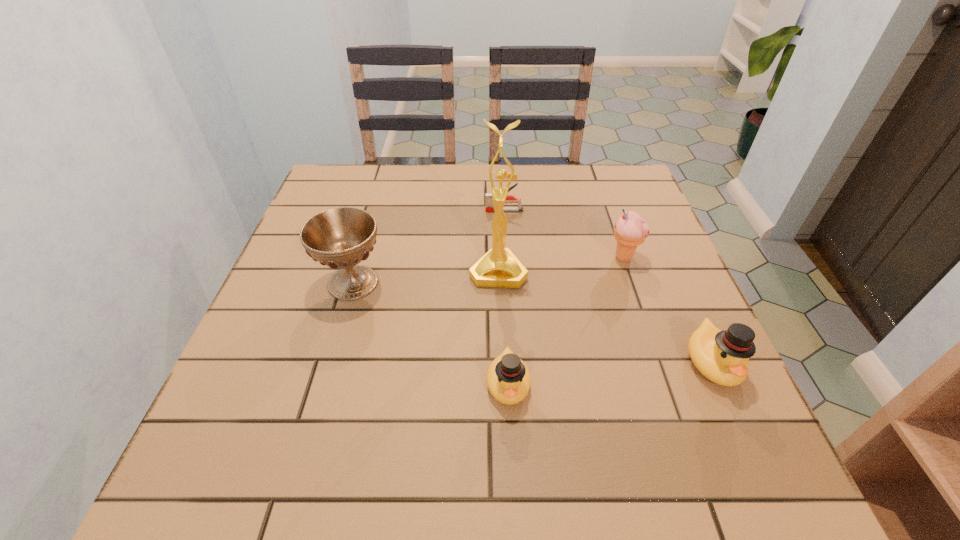
In the current image, all ducks are evenly spaced. To maintain this equal spacing, where should an additional duck be placed on the left? Please point out a free spot. Please provide its 2D coordinates. Your answer should be formatted as a tuple, i.e. [(x, y)], where the tuple contains the x and y coordinates of a point satisfying the conditions above.

[(286, 407)]